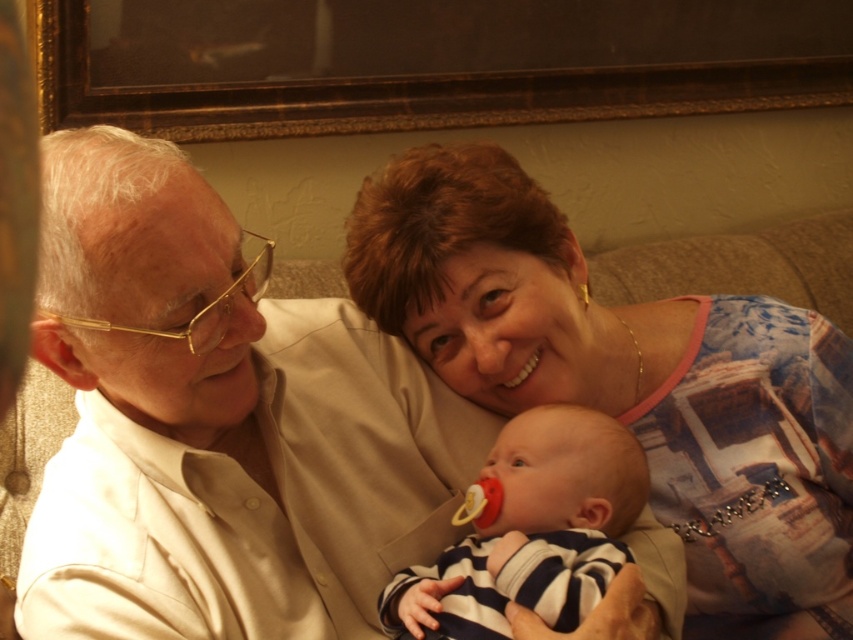
Does matte beige blouse at upper right appear over dark brown wooden picture frame at upper center?

Actually, matte beige blouse at upper right is below dark brown wooden picture frame at upper center.

Who is higher up, matte beige blouse at upper right or dark brown wooden picture frame at upper center?

dark brown wooden picture frame at upper center is above.

Does point (386, 193) come closer to viewer compared to point (134, 80)?

Yes.

I want to click on matte beige blouse at upper right, so click(x=630, y=380).

The image size is (853, 640). Identify the location of dark brown wooden picture frame at upper center. (431, 61).

Between dark brown wooden picture frame at upper center and striped fabric baby at center, which one has more height?

dark brown wooden picture frame at upper center

Who is more distant from viewer, [155,93] or [521,566]?

Point [155,93]

What are the coordinates of `dark brown wooden picture frame at upper center` in the screenshot? It's located at (431, 61).

Is matte beige blouse at upper right closer to camera compared to striped fabric baby at center?

No.

Is matte beige blouse at upper right further to the viewer compared to striped fabric baby at center?

Yes, matte beige blouse at upper right is further from the viewer.

The image size is (853, 640). What do you see at coordinates (630, 380) in the screenshot?
I see `matte beige blouse at upper right` at bounding box center [630, 380].

This screenshot has height=640, width=853. I want to click on matte beige blouse at upper right, so click(x=630, y=380).